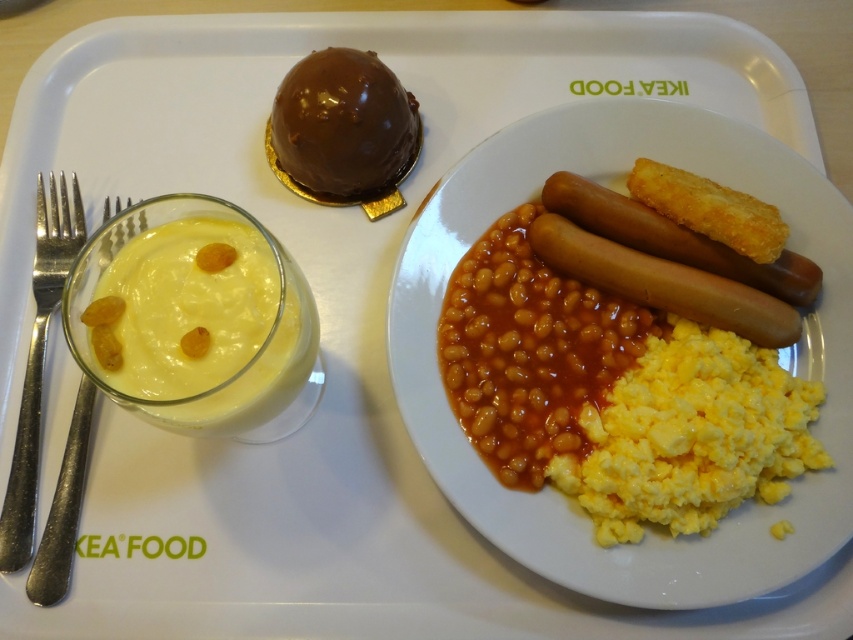
Which is in front, point (335, 77) or point (548, 177)?

Point (335, 77) is more forward.

Is point (306, 100) behind point (804, 280)?

Yes.

I want to click on chocolate glaze dome at upper center, so click(341, 125).

Is brown matte hot dog at center above silver metallic fork at left?

Yes.

Does brown matte hot dog at center have a smaller size compared to silver metallic fork at left?

Yes, brown matte hot dog at center is smaller than silver metallic fork at left.

Which is in front, point (773, 282) or point (20, 465)?

Positioned in front is point (20, 465).

I want to click on brown matte hot dog at center, so click(x=675, y=237).

How distant is brown matte hot dog at center from silvermetallicforks at left?

A distance of 17.54 inches exists between brown matte hot dog at center and silvermetallicforks at left.

Can you confirm if brown matte hot dog at center is wider than silvermetallicforks at left?

Indeed, brown matte hot dog at center has a greater width compared to silvermetallicforks at left.

What do you see at coordinates (675, 237) in the screenshot? I see `brown matte hot dog at center` at bounding box center [675, 237].

At what (x,y) coordinates should I click in order to perform the action: click on brown matte hot dog at center. Please return your answer as a coordinate pair (x, y). Looking at the image, I should click on (675, 237).